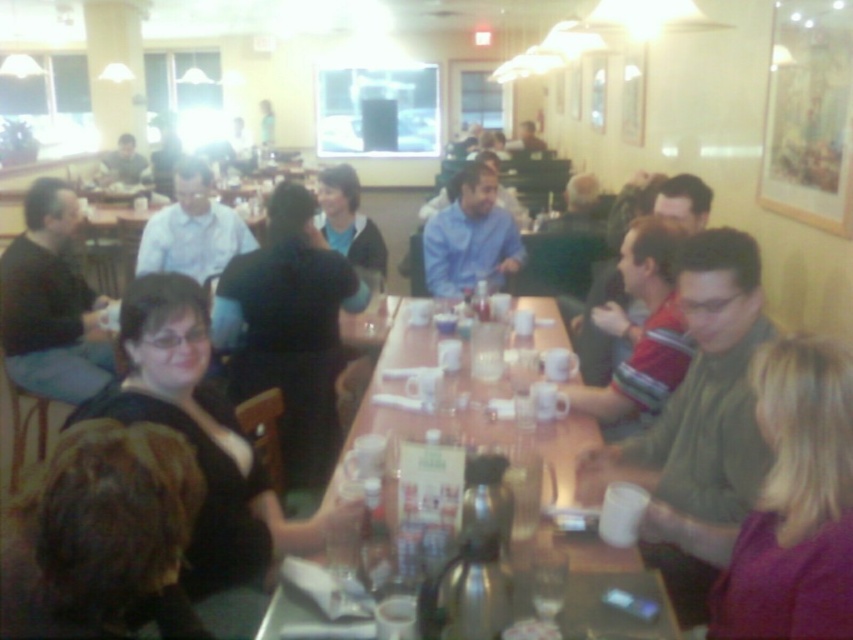
Is wooden table at center bigger than white shirt at center?

Indeed, wooden table at center has a larger size compared to white shirt at center.

Who is more forward, (677,634) or (189,205)?

Positioned in front is point (677,634).

Identify the location of wooden table at center. The width and height of the screenshot is (853, 640). (469, 419).

How far apart are brown fur at lower left and blue shirt at center?

brown fur at lower left and blue shirt at center are 9.79 feet apart.

This screenshot has height=640, width=853. I want to click on brown fur at lower left, so click(97, 529).

Does point (172, 536) come farther from viewer compared to point (495, 236)?

No, it is not.

Identify the location of brown fur at lower left. point(97,529).

Between point (468, 166) and point (326, 218), which one is positioned behind?

The point (326, 218) is behind.

Identify the location of blue shirt at center. The height and width of the screenshot is (640, 853). (469, 236).

Between point (496, 282) and point (349, 196), which one is positioned in front?

Point (349, 196) is more forward.

Where is `blue shirt at center`? blue shirt at center is located at coordinates (469, 236).